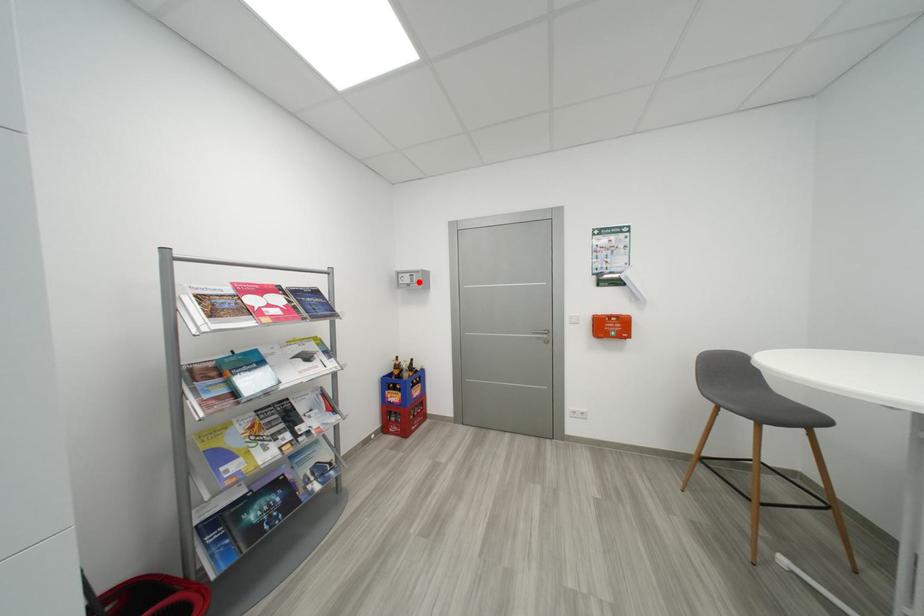
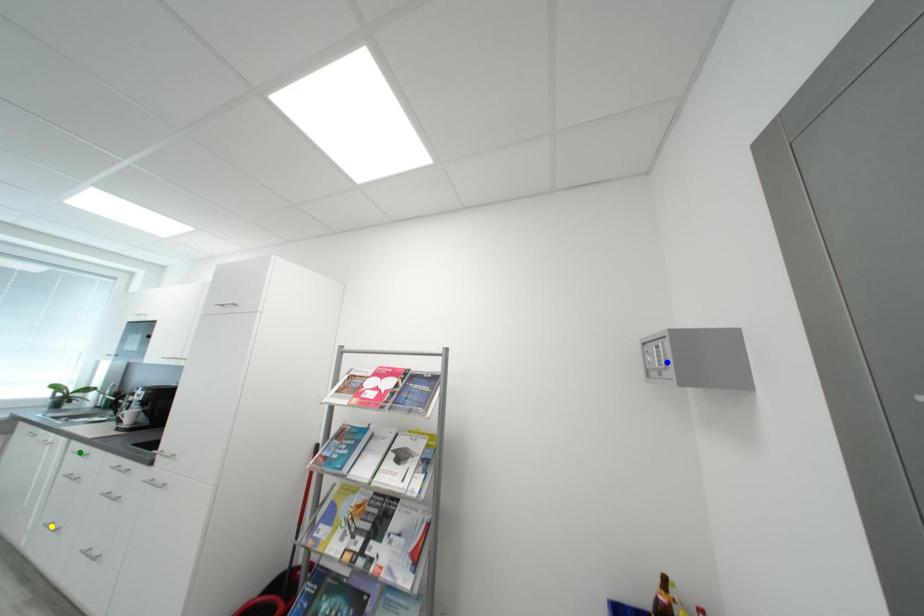
Question: I am providing you with two images of the same scene from different viewpoints. A red point is marked on the first image. You are given multiple points on the second image. Which mark in image 2 goes with the point in image 1?

Choices:
 (A) blue point
 (B) yellow point
 (C) green point

Answer: (A)